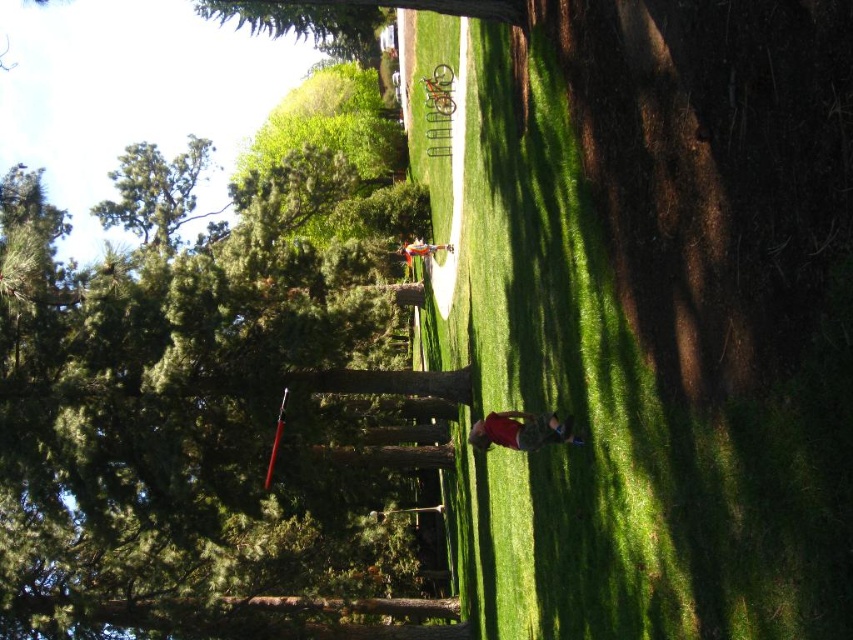
You are planning to take a photo of the green textured tree at upper left and the matte white shirt at center. Which object should you focus on first if you want both to be in sharp focus?

You should focus on the green textured tree at upper left first because it is larger in size than the matte white shirt at center, so it requires more precise focusing to ensure sharpness.

You are standing in the park and see the green textured tree at upper left and the matte white shirt at center. Which object is closer to you?

The green textured tree at upper left is closer to you because it is in front of the matte white shirt at center.

You are standing in the park and want to walk from point A to point B. Point A is at coordinates point [233,253] and point B is at coordinates point [486,416]. Which point is closer to you?

Point A at coordinates point [233,253] is closer to you since it is further to the viewer than point B at coordinates point [486,416].